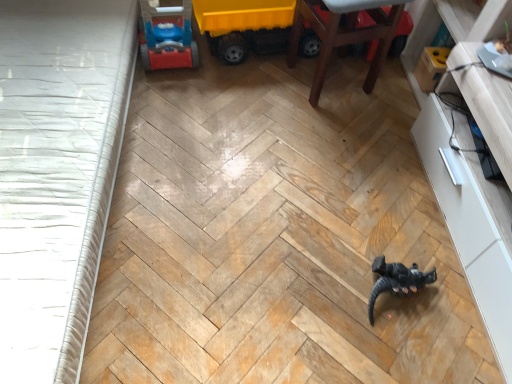
Question: From the image's perspective, is yellow plastic toy truck at upper center, which is the 2th toy in right-to-left order, above black matte dinosaur at center, which is the 2th toy from back to front?

Choices:
 (A) yes
 (B) no

Answer: (A)

Question: Is the depth of yellow plastic toy truck at upper center, which is the 2th toy in right-to-left order, greater than that of black matte dinosaur at center, which is the 2th toy from back to front?

Choices:
 (A) no
 (B) yes

Answer: (B)

Question: Is yellow plastic toy truck at upper center, which is the 2th toy in right-to-left order, positioned with its back to black matte dinosaur at center, the 1th toy when ordered from right to left?

Choices:
 (A) no
 (B) yes

Answer: (A)

Question: Is yellow plastic toy truck at upper center, arranged as the 2th toy when ordered from the bottom, taller than black matte dinosaur at center, the 1th toy when ordered from right to left?

Choices:
 (A) no
 (B) yes

Answer: (B)

Question: Does yellow plastic toy truck at upper center, arranged as the 2th toy when ordered from the bottom, appear on the right side of black matte dinosaur at center, which is the 2th toy in top-to-bottom order?

Choices:
 (A) yes
 (B) no

Answer: (B)

Question: Considering the positions of white textured bed frame at left and yellow plastic toy truck at upper center, acting as the first toy starting from the top, in the image, is white textured bed frame at left wider or thinner than yellow plastic toy truck at upper center, acting as the first toy starting from the top,?

Choices:
 (A) wide
 (B) thin

Answer: (A)

Question: Does point (31, 192) appear closer or farther from the camera than point (249, 11)?

Choices:
 (A) farther
 (B) closer

Answer: (B)

Question: Visually, is white textured bed frame at left positioned to the left or to the right of yellow plastic toy truck at upper center, which appears as the second toy when viewed from the front?

Choices:
 (A) right
 (B) left

Answer: (B)

Question: From a real-world perspective, is white textured bed frame at left physically located above or below yellow plastic toy truck at upper center, acting as the first toy starting from the top?

Choices:
 (A) above
 (B) below

Answer: (B)

Question: Would you say black matte dinosaur at center, the first toy positioned from the bottom, is to the left or to the right of yellow plastic toy truck at upper center, which appears as the second toy when viewed from the front, in the picture?

Choices:
 (A) left
 (B) right

Answer: (B)

Question: Is black matte dinosaur at center, the first toy positioned from the bottom, in front of or behind yellow plastic toy truck at upper center, which is the 1th toy from left to right, in the image?

Choices:
 (A) front
 (B) behind

Answer: (A)

Question: In terms of height, does black matte dinosaur at center, which is the 2th toy in top-to-bottom order, look taller or shorter compared to yellow plastic toy truck at upper center, which is the 1th toy from left to right?

Choices:
 (A) tall
 (B) short

Answer: (B)

Question: From a real-world perspective, is black matte dinosaur at center, which is the 2th toy from back to front, above or below yellow plastic toy truck at upper center, which is the 2th toy in right-to-left order?

Choices:
 (A) below
 (B) above

Answer: (A)

Question: Visually, is yellow plastic toy truck at upper center, acting as the first toy starting from the top, positioned to the left or to the right of white glossy dresser at right?

Choices:
 (A) left
 (B) right

Answer: (A)

Question: From the image's perspective, is yellow plastic toy truck at upper center, acting as the first toy starting from the top, above or below white glossy dresser at right?

Choices:
 (A) above
 (B) below

Answer: (A)